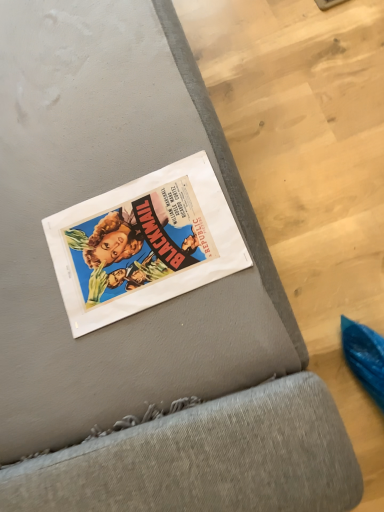
Where is `empty space that is ontop of matte paper poster at center (from a real-world perspective)`? empty space that is ontop of matte paper poster at center (from a real-world perspective) is located at coordinates (137, 237).